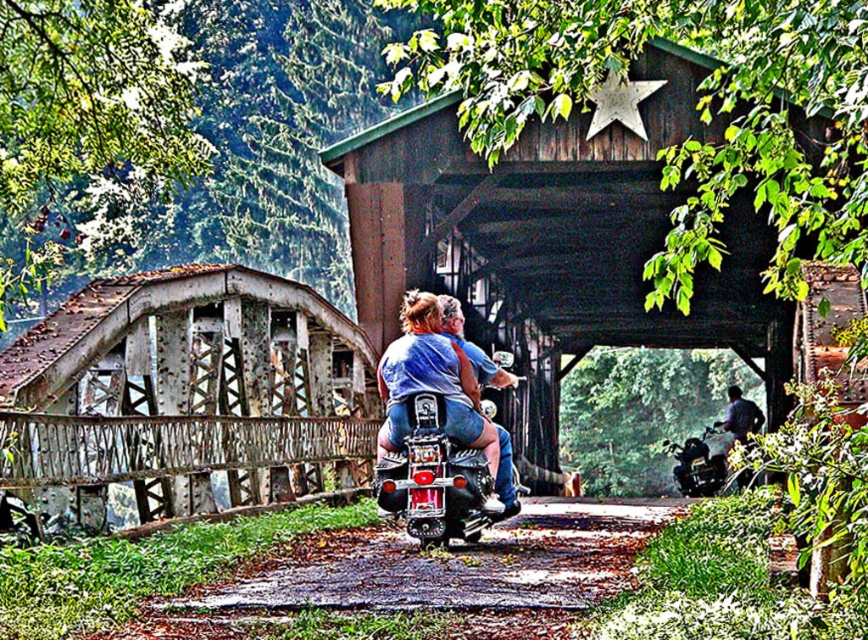
Question: Is rusty metal bridge at left to the right of dark blue jeans at lower right from the viewer's perspective?

Choices:
 (A) yes
 (B) no

Answer: (B)

Question: Which of the following is the closest to the observer?

Choices:
 (A) rusty metal bridge at left
 (B) matte blue jeans at center
 (C) dark blue jeans at lower right

Answer: (A)

Question: Which object is positioned farthest from the matte blue jeans at center?

Choices:
 (A) rusty metal bridge at left
 (B) dark blue jeans at lower right

Answer: (B)

Question: Does matte blue jeans at center appear on the left side of dark blue jeans at lower right?

Choices:
 (A) no
 (B) yes

Answer: (B)

Question: Which point is closer to the camera?

Choices:
 (A) pos(293,300)
 (B) pos(424,355)
 (C) pos(748,403)

Answer: (B)

Question: Does rusty metal bridge at left have a lesser width compared to dark blue jeans at lower right?

Choices:
 (A) yes
 (B) no

Answer: (B)